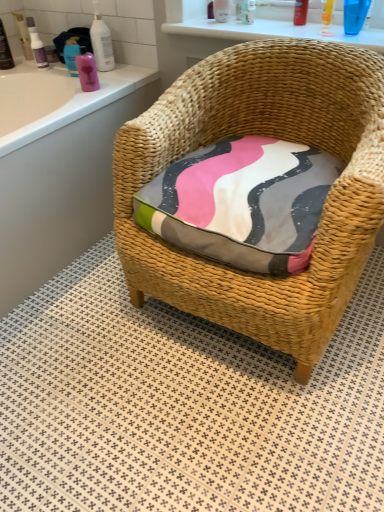
Find the location of a particular element. This screenshot has width=384, height=512. free location in front of woven wicker chair at center is located at coordinates coord(230,432).